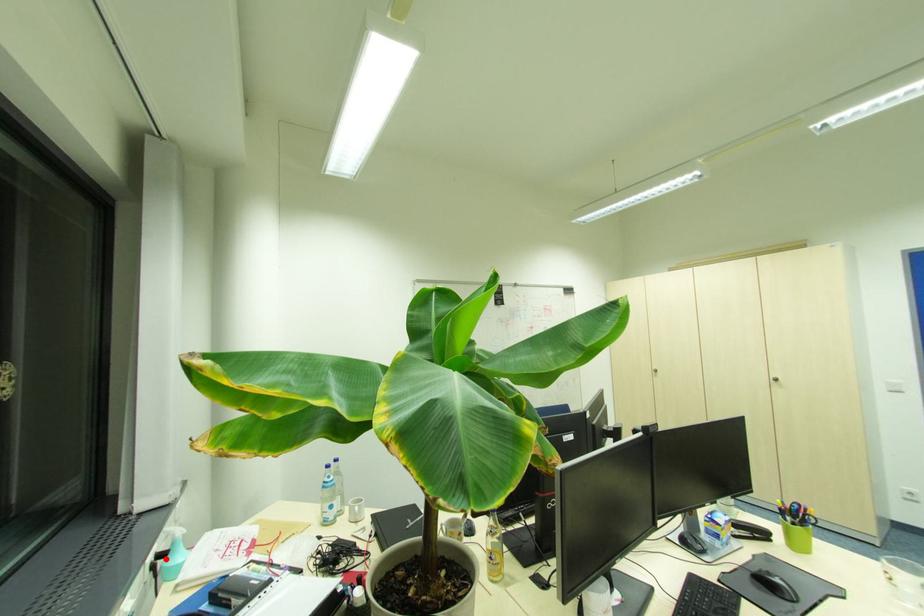
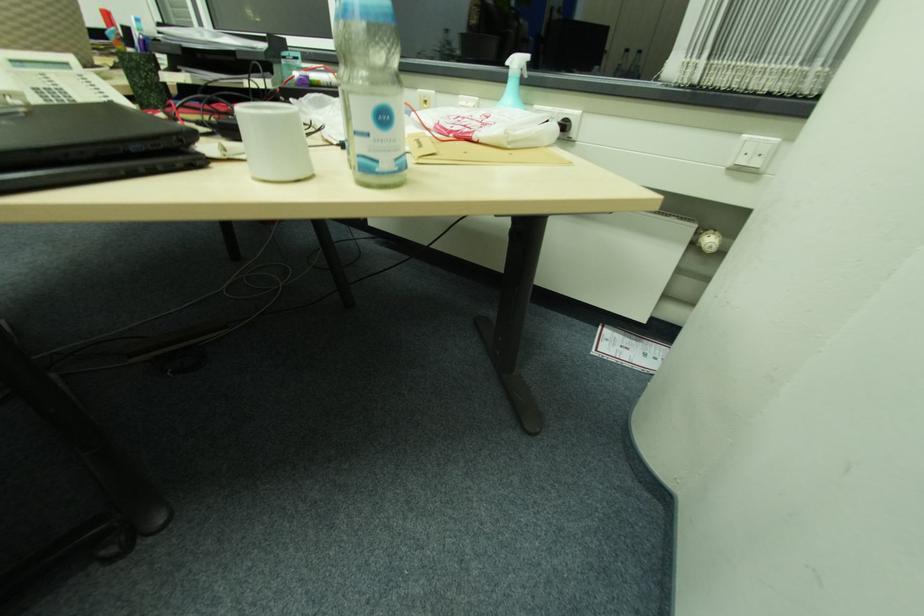
Question: I am providing you with two images of the same scene from different viewpoints. A red point is marked on the first image. At the location where the point appears in image 1, is it still visible in image 2?

Choices:
 (A) Yes
 (B) No

Answer: (B)